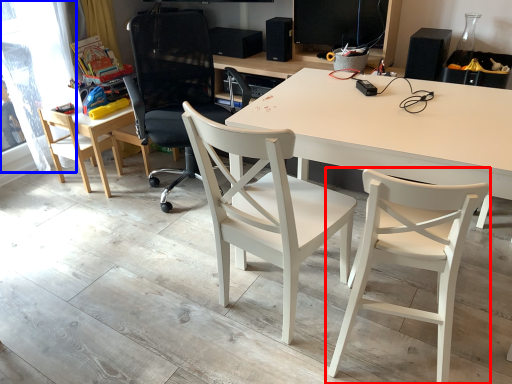
Question: Which point is closer to the camera, chair (highlighted by a red box) or window screen (highlighted by a blue box)?

Choices:
 (A) chair
 (B) window screen

Answer: (A)